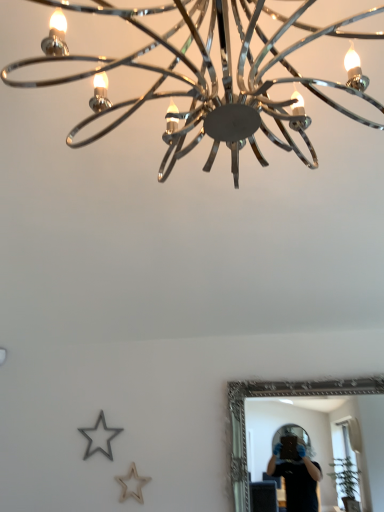
Question: In terms of height, does silver/golden metallic mirror at lower right look taller or shorter compared to chrome/metallic chandelier at upper center?

Choices:
 (A) tall
 (B) short

Answer: (B)

Question: Considering the positions of point (301, 397) and point (301, 120), is point (301, 397) closer or farther from the camera than point (301, 120)?

Choices:
 (A) closer
 (B) farther

Answer: (B)

Question: Considering the relative positions of silver/golden metallic mirror at lower right and chrome/metallic chandelier at upper center in the image provided, is silver/golden metallic mirror at lower right to the left or to the right of chrome/metallic chandelier at upper center?

Choices:
 (A) right
 (B) left

Answer: (A)

Question: Do you think chrome/metallic chandelier at upper center is within silver/golden metallic mirror at lower right, or outside of it?

Choices:
 (A) outside
 (B) inside

Answer: (A)

Question: Is chrome/metallic chandelier at upper center wider or thinner than silver/golden metallic mirror at lower right?

Choices:
 (A) thin
 (B) wide

Answer: (B)

Question: In terms of height, does chrome/metallic chandelier at upper center look taller or shorter compared to silver/golden metallic mirror at lower right?

Choices:
 (A) short
 (B) tall

Answer: (B)

Question: Is point pyautogui.click(x=205, y=93) closer or farther from the camera than point pyautogui.click(x=375, y=402)?

Choices:
 (A) farther
 (B) closer

Answer: (B)